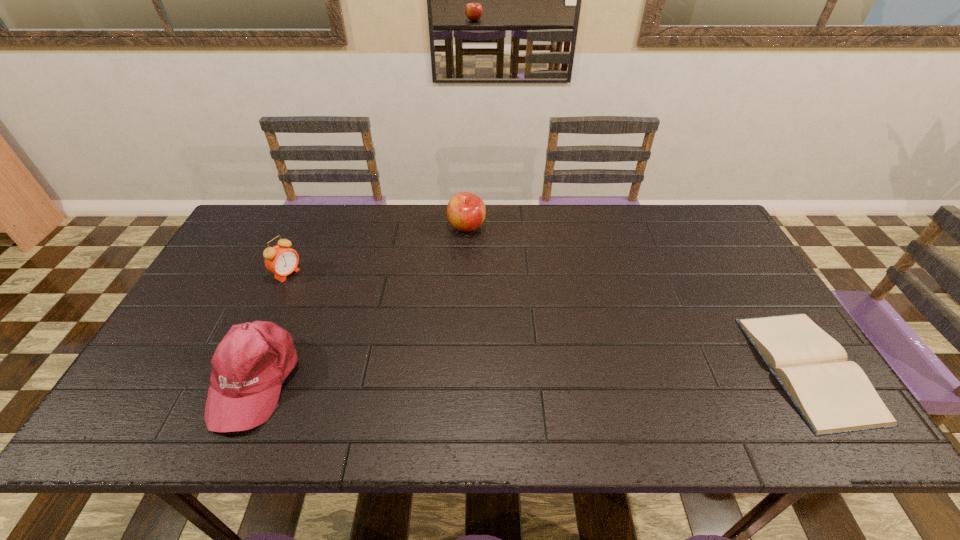
Where is `free space located 0.120m on the face of the alarm clock`? free space located 0.120m on the face of the alarm clock is located at coordinates (324, 296).

This screenshot has width=960, height=540. I want to click on free spot located on the face of the alarm clock, so click(364, 318).

The height and width of the screenshot is (540, 960). Identify the location of free space located 0.350m on the face of the alarm clock. (386, 330).

Identify the location of object situated at the far edge. Image resolution: width=960 pixels, height=540 pixels. (466, 212).

I want to click on baseball cap positioned at the near edge, so click(x=249, y=365).

At what (x,y) coordinates should I click in order to perform the action: click on Bible that is at the near edge. Please return your answer as a coordinate pair (x, y). The height and width of the screenshot is (540, 960). Looking at the image, I should click on (833, 395).

At what (x,y) coordinates should I click in order to perform the action: click on object that is at the left edge. Please return your answer as a coordinate pair (x, y). Looking at the image, I should click on (249, 365).

At what (x,y) coordinates should I click in order to perform the action: click on object that is at the right edge. Please return your answer as a coordinate pair (x, y). Looking at the image, I should click on (833, 395).

The image size is (960, 540). Identify the location of object present at the near left corner. (249, 365).

This screenshot has height=540, width=960. Find the location of `object that is at the near right corner`. object that is at the near right corner is located at coordinates (833, 395).